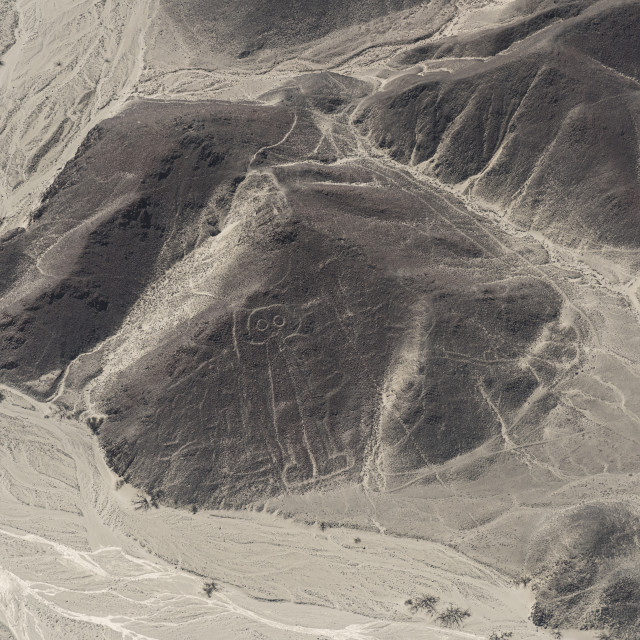
Find the location of a particular element. The image size is (640, 640). light colored surface is located at coordinates coord(92,538), coord(364,550), coord(173,609).